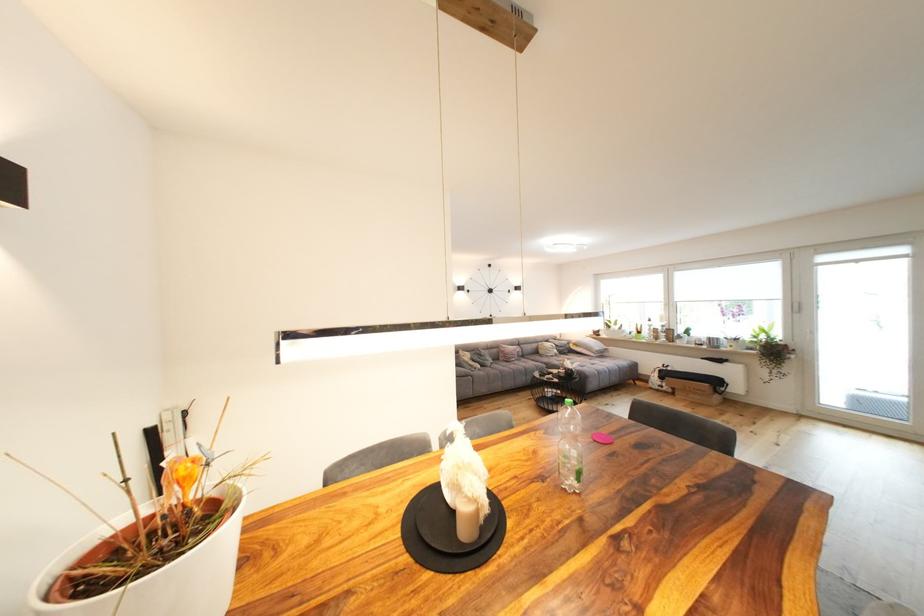
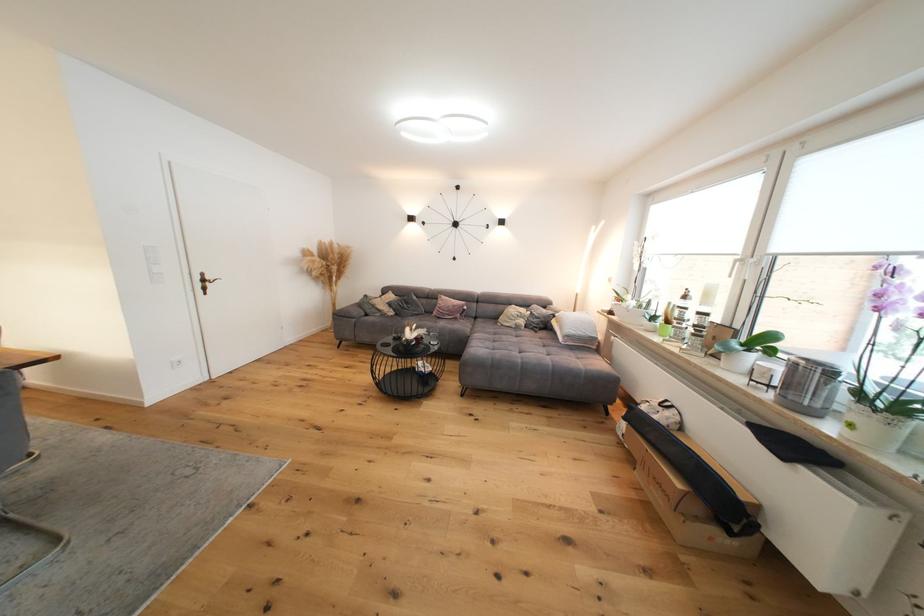
In the second image, find the point that corresponds to the point at 564,357 in the first image.

(524, 330)